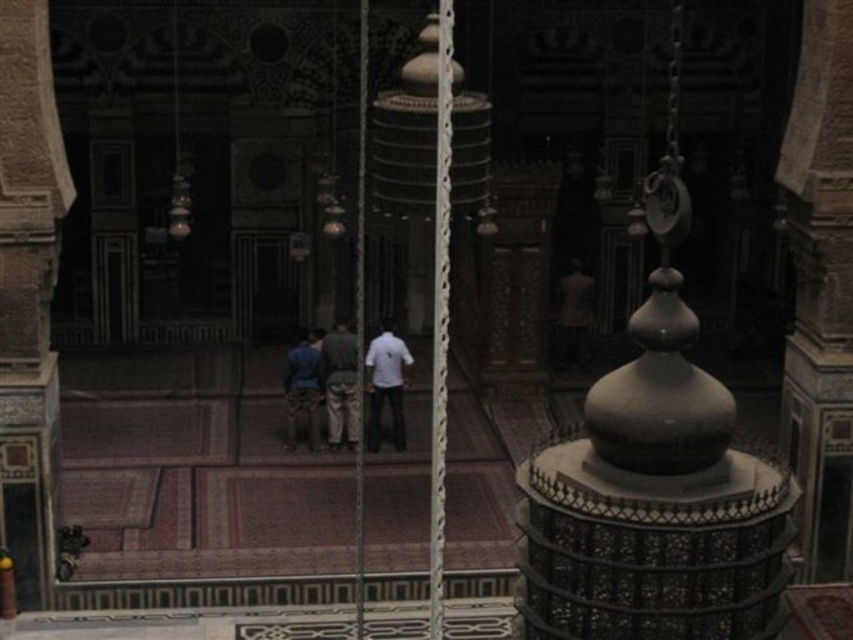
Is light brown fabric pants at center bigger than blue fabric pants at center?

Incorrect, light brown fabric pants at center is not larger than blue fabric pants at center.

In the scene shown: Does light brown fabric pants at center appear on the right side of blue fabric pants at center?

Correct, you'll find light brown fabric pants at center to the right of blue fabric pants at center.

Is point (349, 352) positioned after point (302, 339)?

That is False.

Locate an element on the screen. The width and height of the screenshot is (853, 640). light brown fabric pants at center is located at coordinates (340, 384).

Can you confirm if white matte shirt at center is positioned to the right of light brown fabric pants at center?

Yes, white matte shirt at center is to the right of light brown fabric pants at center.

Does point (393, 340) come in front of point (351, 364)?

Yes, point (393, 340) is closer to viewer.

Is point (376, 352) less distant than point (346, 394)?

Yes, point (376, 352) is in front of point (346, 394).

Find the location of a particular element. white matte shirt at center is located at coordinates (386, 381).

Is white matte shirt at center thinner than blue fabric pants at center?

No, white matte shirt at center is not thinner than blue fabric pants at center.

Can you confirm if white matte shirt at center is taller than blue fabric pants at center?

Yes, white matte shirt at center is taller than blue fabric pants at center.

Between point (399, 353) and point (299, 384), which one is positioned in front?

Positioned in front is point (299, 384).

Identify the location of white matte shirt at center. (386, 381).